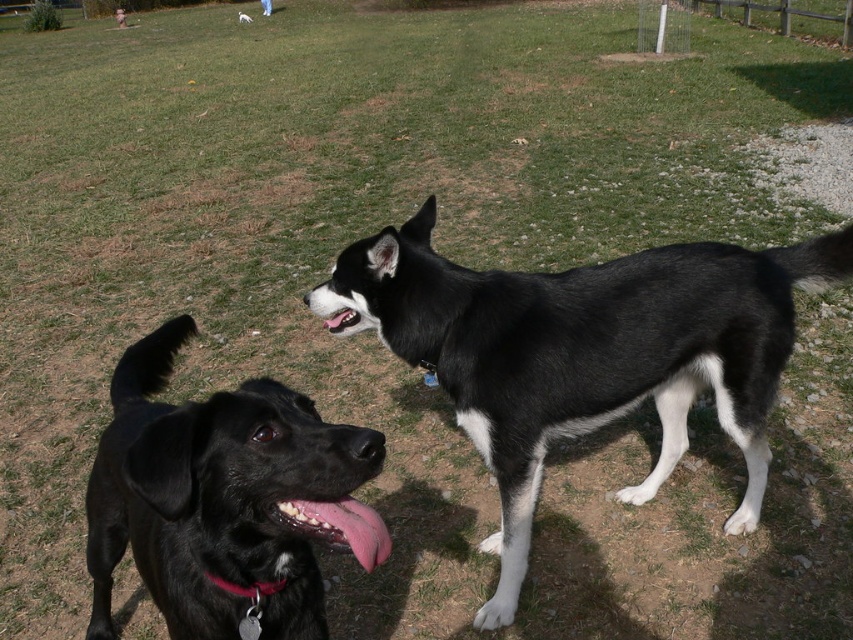
You are standing in the park and see two points marked on the ground. One is at point coordinates point [262,586] and the other is at point [239,12]. Which point is closer to you?

Point [262,586] is closer to the viewer than point [239,12].

You are a dog owner who wants to ensure your dog has a collar that fits properly. You have two options in the image, the red leather collar at lower left and the black matte dog at center. Which collar is more likely to be a proper fit for a dog with a slender neck?

The red leather collar at lower left is thinner than the black matte dog at center, so it would be more suitable for a dog with a slender neck.